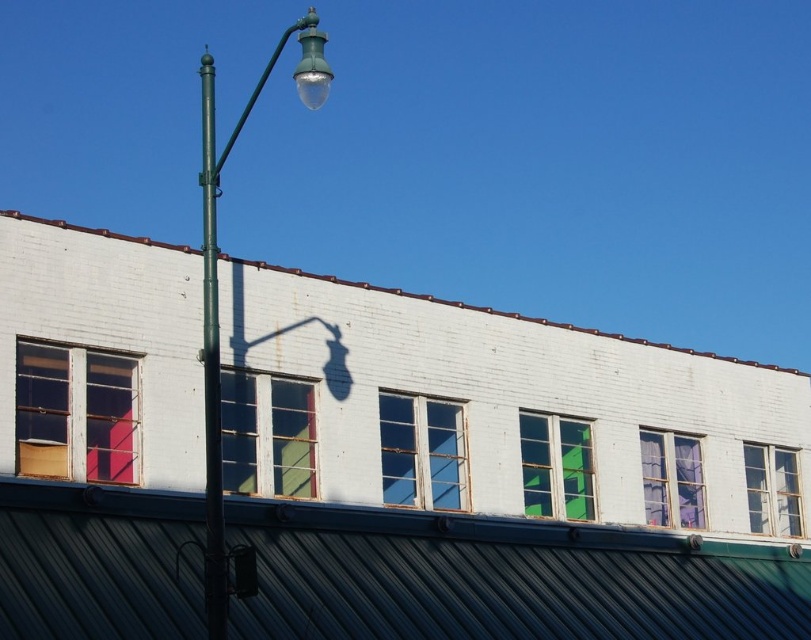
Question: Is the position of matte glass window at center more distant than that of clear glass window at right?

Choices:
 (A) no
 (B) yes

Answer: (A)

Question: Can you confirm if green glass window at upper center is positioned above purple sheer curtains at upper right?

Choices:
 (A) yes
 (B) no

Answer: (A)

Question: Which is farther from the green metallic pole at left?

Choices:
 (A) matte pink window at left
 (B) matte glass window at center

Answer: (B)

Question: Which point is closer to the camera?

Choices:
 (A) (398, 432)
 (B) (212, 168)

Answer: (B)

Question: Which object is the farthest from the clear glass window at right?

Choices:
 (A) green metallic pole at left
 (B) green glass window at upper center
 (C) matte glass window at center
 (D) clear glass window at center

Answer: (A)

Question: Is matte pink window at left positioned in front of clear glass window at right?

Choices:
 (A) yes
 (B) no

Answer: (A)